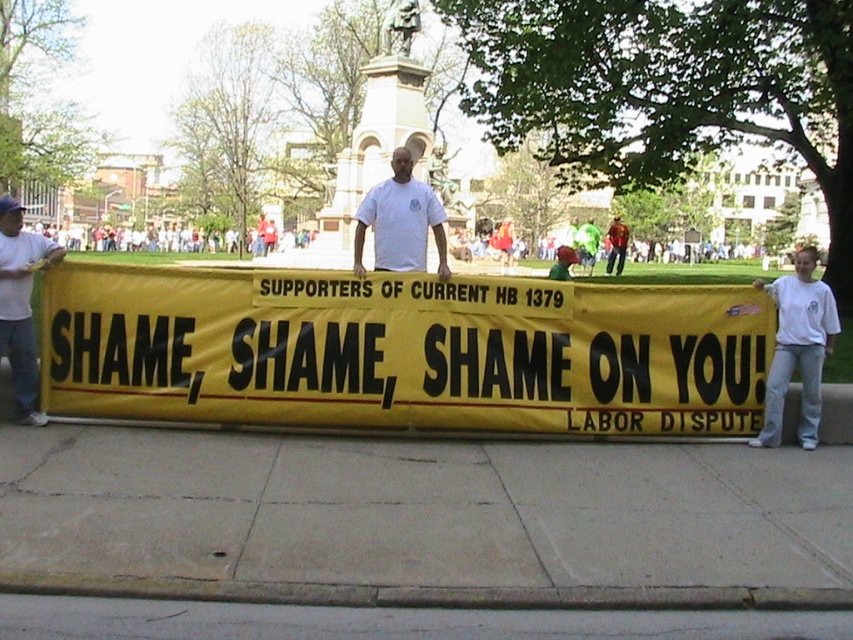
Question: Is gray concrete sidewalk at center in front of white t-shirt at left?

Choices:
 (A) yes
 (B) no

Answer: (A)

Question: Which object appears closest to the camera in this image?

Choices:
 (A) gray concrete sidewalk at center
 (B) white t-shirt at center

Answer: (A)

Question: Is yellow/yellow fabric banner at center bigger than white t-shirt at left?

Choices:
 (A) no
 (B) yes

Answer: (A)

Question: Which object appears farthest from the camera in this image?

Choices:
 (A) white t-shirt at left
 (B) yellow/yellow fabric banner at center
 (C) white t-shirt at center
 (D) gray concrete pavement at lower center

Answer: (C)

Question: Is gray concrete sidewalk at center behind yellow/yellow fabric banner at center?

Choices:
 (A) no
 (B) yes

Answer: (A)

Question: Which point is closer to the camera taking this photo?

Choices:
 (A) (817, 333)
 (B) (3, 323)
 (C) (149, 624)

Answer: (C)